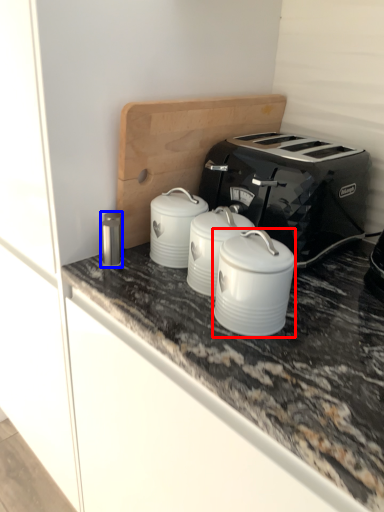
Question: Which of the following is the closest to the observer, appliance (highlighted by a red box) or appliance (highlighted by a blue box)?

Choices:
 (A) appliance
 (B) appliance

Answer: (A)